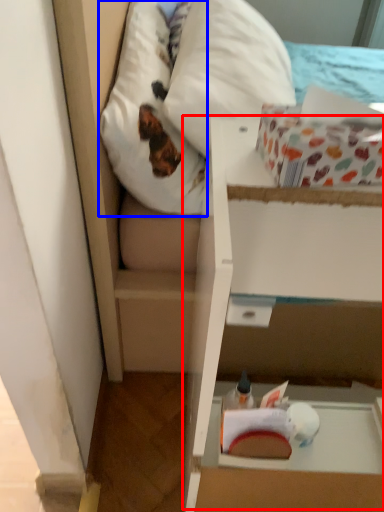
Question: Which object is closer to the camera taking this photo, cardboard box (highlighted by a red box) or pillow (highlighted by a blue box)?

Choices:
 (A) cardboard box
 (B) pillow

Answer: (A)